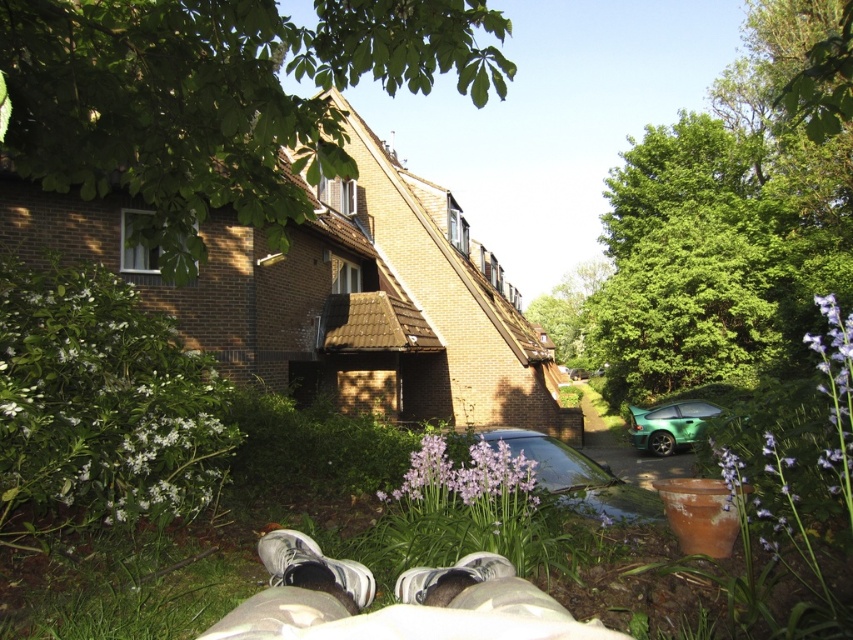
Can you confirm if white matte bush at lower left is positioned to the left of green metallic car at right?

Yes, white matte bush at lower left is to the left of green metallic car at right.

Who is taller, white matte bush at lower left or green metallic car at right?

With more height is green metallic car at right.

Image resolution: width=853 pixels, height=640 pixels. What do you see at coordinates (102, 401) in the screenshot?
I see `white matte bush at lower left` at bounding box center [102, 401].

Where is `white matte bush at lower left`? white matte bush at lower left is located at coordinates (102, 401).

Does shiny metallic car at center come behind purple matte flower at right?

Yes, shiny metallic car at center is behind purple matte flower at right.

Is point (547, 438) farther from camera compared to point (846, 461)?

Yes, it is behind point (846, 461).

The image size is (853, 640). In order to click on shiny metallic car at center in this screenshot , I will do `click(572, 476)`.

Which is below, white textured shoe at lower center or white fabric shoe at lower center?

white textured shoe at lower center is lower down.

Which is behind, point (358, 604) or point (492, 573)?

The point (492, 573) is more distant.

The width and height of the screenshot is (853, 640). I want to click on white textured shoe at lower center, so click(312, 561).